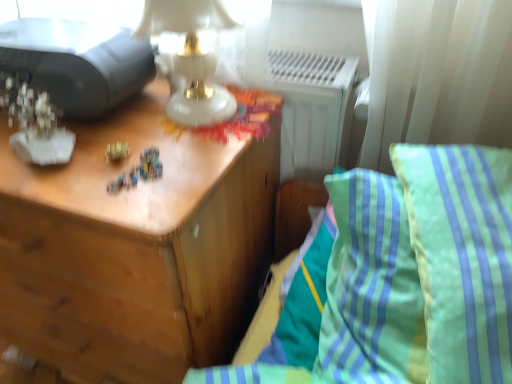
This screenshot has width=512, height=384. I want to click on vacant area that is situated to the right of gold metallic toy at center, so click(x=196, y=145).